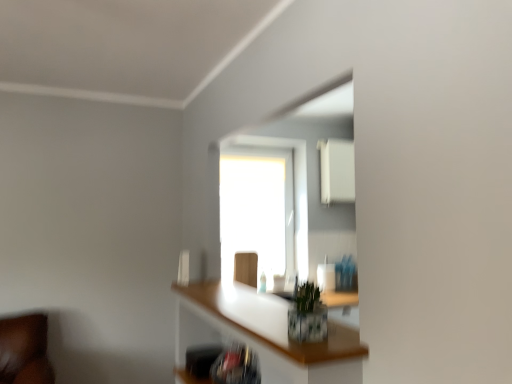
Question: Is wooden swivel chair at center looking in the opposite direction of translucent glass shelf at center?

Choices:
 (A) yes
 (B) no

Answer: (B)

Question: Is translucent glass shelf at center located within wooden swivel chair at center?

Choices:
 (A) no
 (B) yes

Answer: (A)

Question: Does wooden swivel chair at center have a greater width compared to translucent glass shelf at center?

Choices:
 (A) yes
 (B) no

Answer: (B)

Question: Is the position of wooden swivel chair at center less distant than that of translucent glass shelf at center?

Choices:
 (A) yes
 (B) no

Answer: (B)

Question: Does wooden swivel chair at center have a lesser width compared to translucent glass shelf at center?

Choices:
 (A) no
 (B) yes

Answer: (B)

Question: Can we say wooden swivel chair at center lies outside translucent glass shelf at center?

Choices:
 (A) no
 (B) yes

Answer: (B)

Question: From the image's perspective, would you say green leafy plant at center is positioned over wooden swivel chair at center?

Choices:
 (A) no
 (B) yes

Answer: (B)

Question: From a real-world perspective, does green leafy plant at center sit lower than wooden swivel chair at center?

Choices:
 (A) yes
 (B) no

Answer: (B)

Question: Can you confirm if green leafy plant at center is shorter than wooden swivel chair at center?

Choices:
 (A) no
 (B) yes

Answer: (B)

Question: Can you confirm if green leafy plant at center is thinner than wooden swivel chair at center?

Choices:
 (A) yes
 (B) no

Answer: (B)

Question: Can you confirm if green leafy plant at center is wider than wooden swivel chair at center?

Choices:
 (A) yes
 (B) no

Answer: (A)

Question: Considering the relative sizes of green leafy plant at center and wooden swivel chair at center in the image provided, is green leafy plant at center smaller than wooden swivel chair at center?

Choices:
 (A) yes
 (B) no

Answer: (A)

Question: Is transparent glass window at center bigger than wooden swivel chair at center?

Choices:
 (A) no
 (B) yes

Answer: (B)